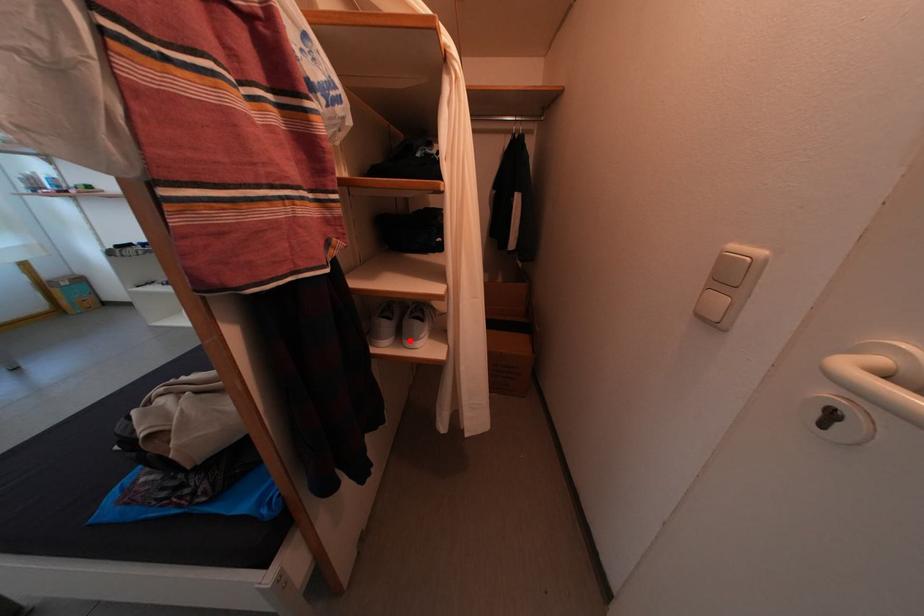
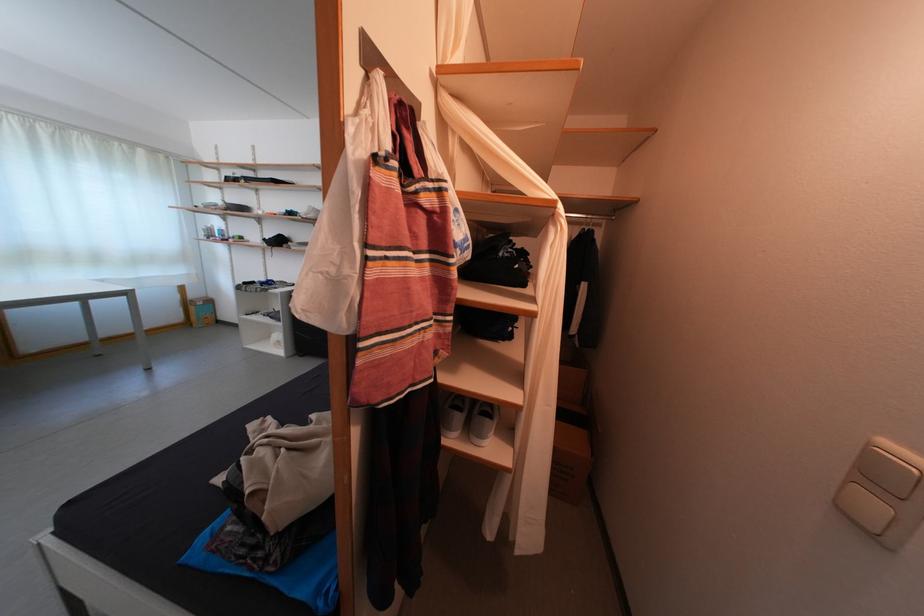
Find the pixel in the second image that matches the highlighted location in the first image.

(479, 435)